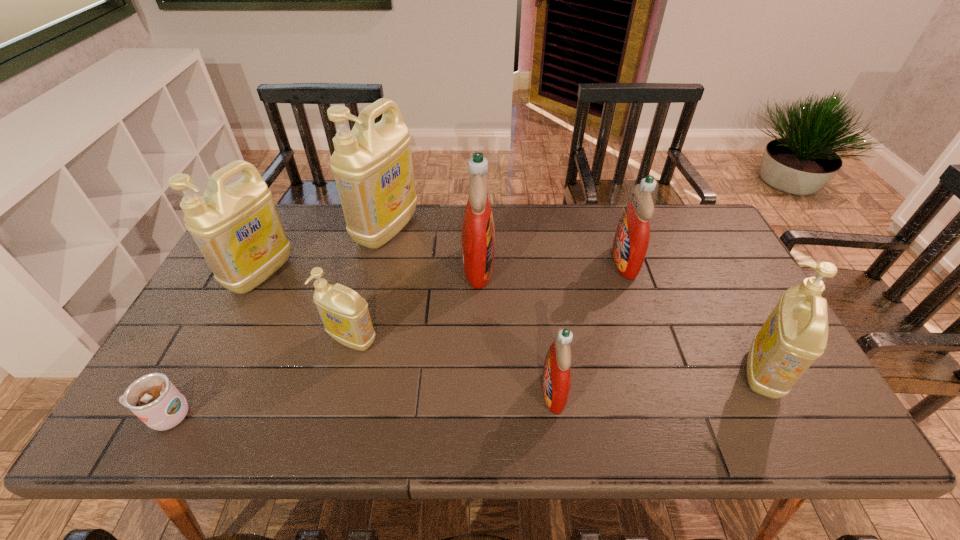
At what (x,y) coordinates should I click in order to perform the action: click on free space between the tallest object and the second smallest red detergent. Please return your answer as a coordinate pair (x, y). The image size is (960, 540). Looking at the image, I should click on (506, 246).

At what (x,y) coordinates should I click in order to perform the action: click on vacant area that lies between the rightmost object and the seventh object from left to right. Please return your answer as a coordinate pair (x, y). The width and height of the screenshot is (960, 540). Looking at the image, I should click on (694, 317).

Identify the location of vacant space that's between the sixth detergent from left to right and the second red detergent from right to left. The width and height of the screenshot is (960, 540). (589, 327).

In order to click on free spot between the third detergent from right to left and the rightmost beige detergent in this screenshot , I will do `click(659, 382)`.

The width and height of the screenshot is (960, 540). What are the coordinates of `free point between the biggest beige detergent and the leftmost beige detergent` in the screenshot? It's located at (324, 251).

Where is `unoccupied area between the smallest beige detergent and the shortest object`? This screenshot has height=540, width=960. unoccupied area between the smallest beige detergent and the shortest object is located at coordinates (259, 377).

Locate an element on the screen. The image size is (960, 540). the closest object to the leftmost beige detergent is located at coordinates [x=372, y=164].

Identify which object is the third closest to the leftmost beige detergent. Please provide its 2D coordinates. Your answer should be formatted as a tuple, i.e. [(x, y)], where the tuple contains the x and y coordinates of a point satisfying the conditions above.

[(153, 398)]

I want to click on detergent that is the closest one to the leftmost beige detergent, so click(x=372, y=164).

The width and height of the screenshot is (960, 540). I want to click on the fifth closest detergent to the smallest beige detergent, so click(x=631, y=240).